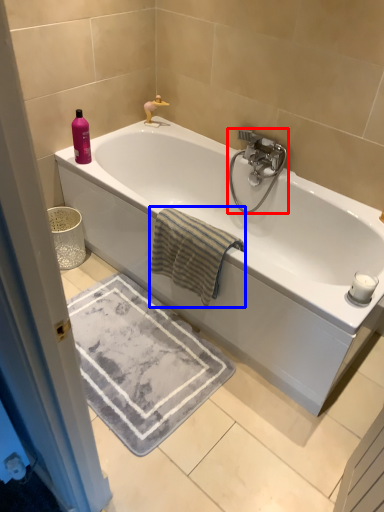
Question: Which point is further to the camera, tap (highlighted by a red box) or beach towel (highlighted by a blue box)?

Choices:
 (A) tap
 (B) beach towel

Answer: (A)